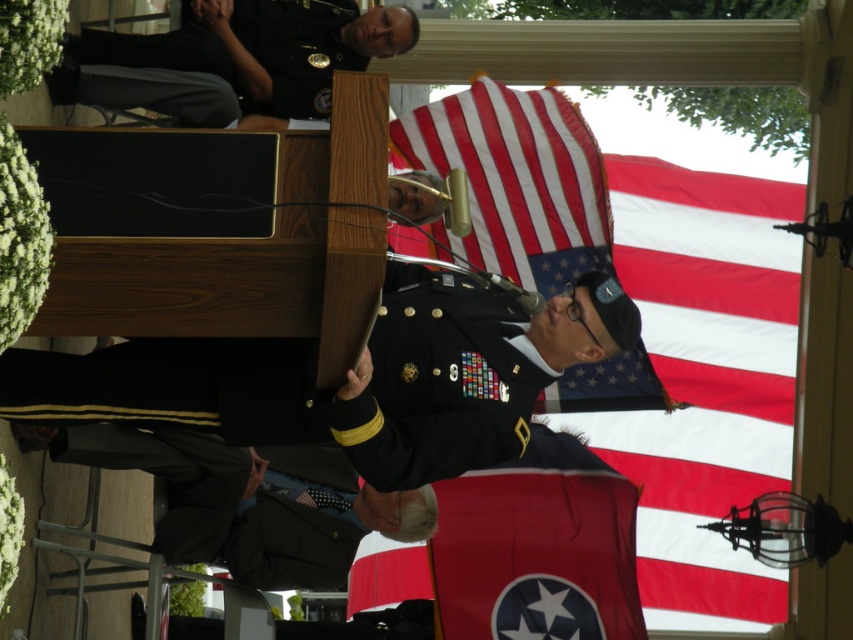
You are a photographer positioned at the front of the event. You need to capture a clear photo of both the shiny black uniform at center and the red fabric flag at center. Which object should you focus on first to ensure both are in focus?

The shiny black uniform at center is closer to the viewer than the red fabric flag at center, so you should focus on the shiny black uniform at center first to ensure both are in focus.